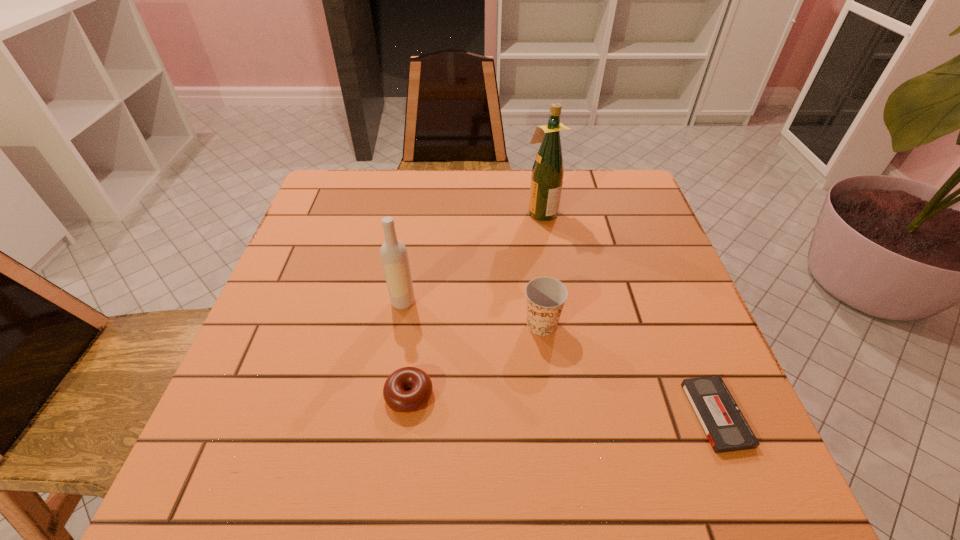
The height and width of the screenshot is (540, 960). I want to click on vacant area that satisfies the following two spatial constraints: 1. on the front-facing side of the shortest object; 2. on the left side of the liquor, so click(x=574, y=414).